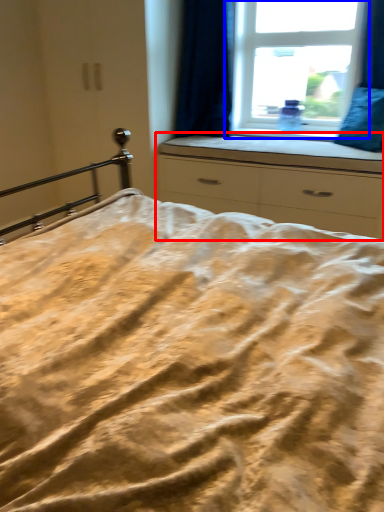
Question: Among these objects, which one is farthest to the camera, chest of drawers (highlighted by a red box) or window (highlighted by a blue box)?

Choices:
 (A) chest of drawers
 (B) window

Answer: (B)